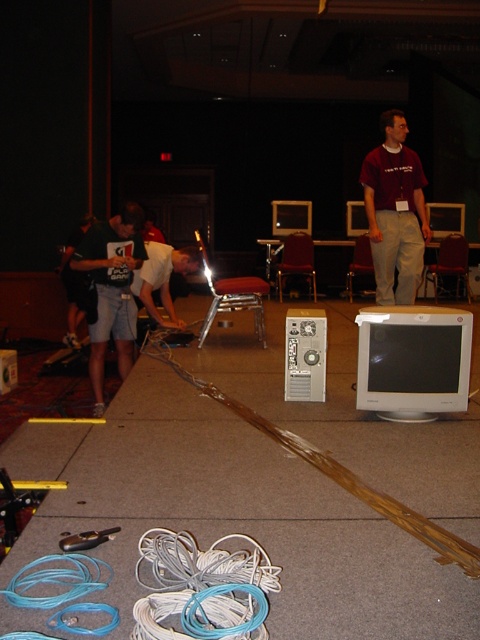
You are setting up a presentation in the conference room and need to hide the cables. Which object between the white rubber wire at lower center and the dark gray shorts at left is lower to the ground and can be easily stepped over?

The white rubber wire at lower center has a lesser height compared to the dark gray shorts at left, so it is lower to the ground and can be easily stepped over.

You are setting up a presentation and need to connect your laptop to the monitor. You see a white rubber wire at lower center and a matte maroon shirt at center. Which object is shorter and can be used to reach the monitor without needing an extension cable?

The white rubber wire at lower center is shorter than the matte maroon shirt at center, so it can be used to reach the monitor without needing an extension cable.

You are a technician who needs to reach the white rubber wire at lower center to fix a connection issue. Considering your height is 1.65 meters, can you safely step over the tangled cables in the foreground without bending down?

The white rubber wire at lower center is 1.70 meters from the viewer. Since your height is 1.65 meters, stepping over the tangled cables in the foreground might be challenging as the distance to the wire is slightly greater than your height. It is advisable to bend down to avoid tripping.